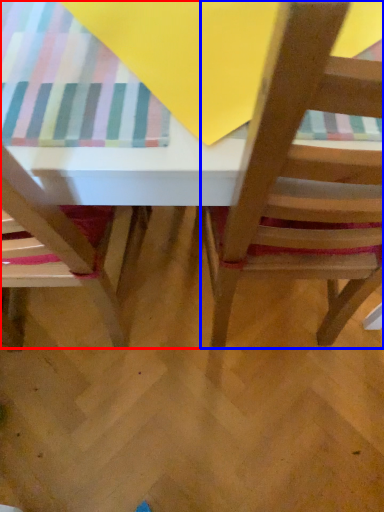
Question: Which object appears closest to the camera in this image, table (highlighted by a red box) or chair (highlighted by a blue box)?

Choices:
 (A) table
 (B) chair

Answer: (B)